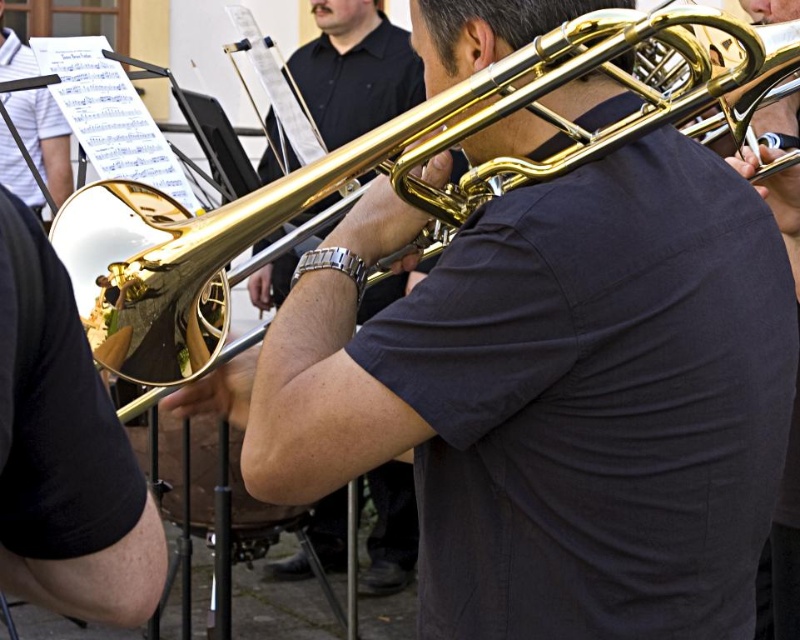
You are a photographer trying to capture the gold shiny trombone at center and the silver metallic watch at center in the same frame. Which object should you focus on first to ensure both are in focus?

The gold shiny trombone at center is positioned over silver metallic watch at center, so you should focus on the gold shiny trombone at center first to ensure both are in focus.

You are a photographer taking a close up shot of the musician playing the trombone. You notice the gold shiny trumpet at center and the silver metallic watch at center. Which object is positioned higher in the image?

The gold shiny trumpet at center is located above the silver metallic watch at center, so it is positioned higher in the image.